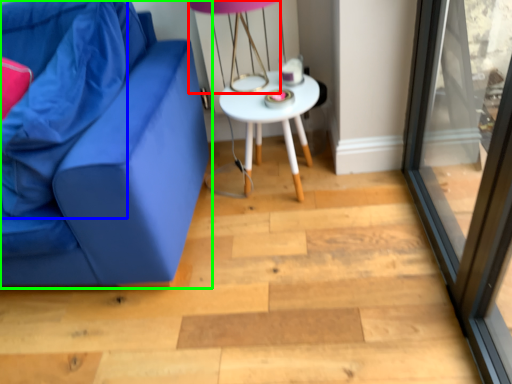
Question: Based on their relative distances, which object is farther from table lamp (highlighted by a red box)? Choose from pillow (highlighted by a blue box) and studio couch (highlighted by a green box).

Choices:
 (A) pillow
 (B) studio couch

Answer: (A)